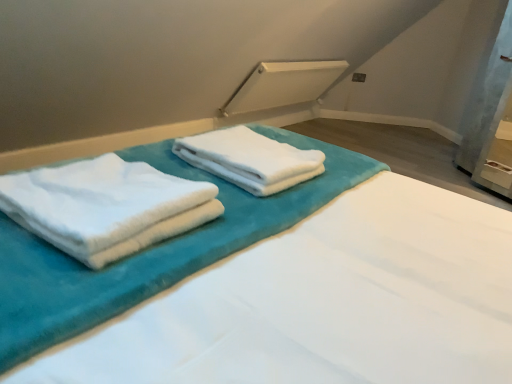
Question: From a real-world perspective, is white fluffy towels at left, the second towel positioned from the back, under white soft towel at center, arranged as the second towel when viewed from the front?

Choices:
 (A) yes
 (B) no

Answer: (B)

Question: From a real-world perspective, does white fluffy towels at left, the 1th towel in the front-to-back sequence, stand above white soft towel at center, which is the first towel in back-to-front order?

Choices:
 (A) yes
 (B) no

Answer: (A)

Question: Is the position of white fluffy towels at left, the second towel positioned from the back, more distant than that of white soft towel at center, which is the first towel in back-to-front order?

Choices:
 (A) yes
 (B) no

Answer: (B)

Question: Can you confirm if white fluffy towels at left, the second towel positioned from the back, is positioned to the left of white soft towel at center, arranged as the second towel when viewed from the front?

Choices:
 (A) yes
 (B) no

Answer: (A)

Question: Can you confirm if white fluffy towels at left, the second towel positioned from the back, is smaller than white soft towel at center, which is the first towel in back-to-front order?

Choices:
 (A) yes
 (B) no

Answer: (B)

Question: Looking at their shapes, would you say white fluffy towels at left, the second towel positioned from the back, is wider or thinner than white soft towels at center?

Choices:
 (A) wide
 (B) thin

Answer: (B)

Question: Does point (20, 215) appear closer or farther from the camera than point (509, 329)?

Choices:
 (A) farther
 (B) closer

Answer: (B)

Question: From the image's perspective, is white fluffy towels at left, the second towel positioned from the back, located above or below white soft towels at center?

Choices:
 (A) above
 (B) below

Answer: (B)

Question: Is white fluffy towels at left, the second towel positioned from the back, bigger or smaller than white soft towels at center?

Choices:
 (A) big
 (B) small

Answer: (B)

Question: Do you think white fluffy towels at left, the 1th towel in the front-to-back sequence, is within white soft towel at center, arranged as the second towel when viewed from the front, or outside of it?

Choices:
 (A) outside
 (B) inside

Answer: (A)

Question: From the image's perspective, relative to white soft towel at center, arranged as the second towel when viewed from the front, is white fluffy towels at left, the second towel positioned from the back, above or below?

Choices:
 (A) above
 (B) below

Answer: (B)

Question: Relative to white soft towel at center, which is the first towel in back-to-front order, is white fluffy towels at left, the 1th towel in the front-to-back sequence, in front or behind?

Choices:
 (A) front
 (B) behind

Answer: (A)

Question: Would you say white fluffy towels at left, the second towel positioned from the back, is to the left or to the right of white soft towel at center, arranged as the second towel when viewed from the front, in the picture?

Choices:
 (A) left
 (B) right

Answer: (A)

Question: Considering the positions of white soft towels at center and white fluffy towels at left, the second towel positioned from the back, in the image, is white soft towels at center wider or thinner than white fluffy towels at left, the second towel positioned from the back,?

Choices:
 (A) wide
 (B) thin

Answer: (A)

Question: Based on their positions, is white soft towels at center located to the left or right of white fluffy towels at left, the 1th towel in the front-to-back sequence?

Choices:
 (A) left
 (B) right

Answer: (B)